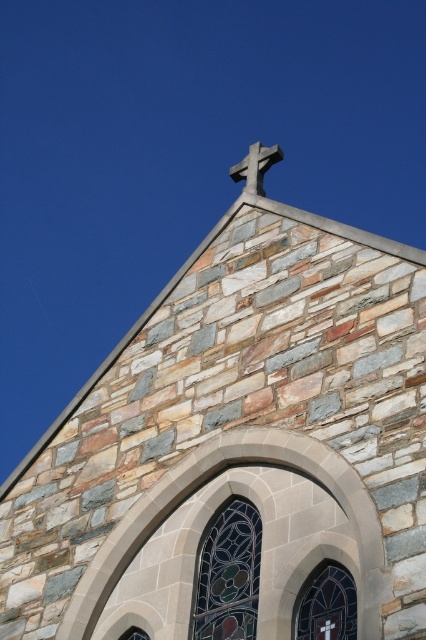
Based on the photo, you are an architect examining the church facade. You notice the stained glass window at upper center and the white stone cross at upper center. Which of these two objects is larger in size?

The stained glass window at upper center is smaller than the white stone cross at upper center, so the white stone cross at upper center is larger in size.

You are an architect examining the church facade. You notice the stained glass window at center and the white stone cross at upper center. Which object is closer to you from your viewing position?

The stained glass window at center is closer to you because it is in front of the white stone cross at upper center.